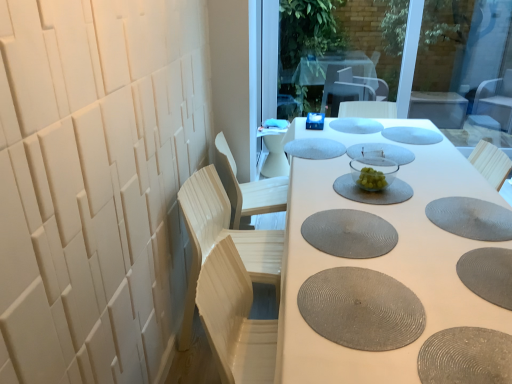
The height and width of the screenshot is (384, 512). Identify the location of free space that is in between clear glass bowl at center, which is counted as the 5th manhole cover, starting from the back, and gray textured placemat at center, which is counted as the fourth manhole cover, starting from the front. (353, 206).